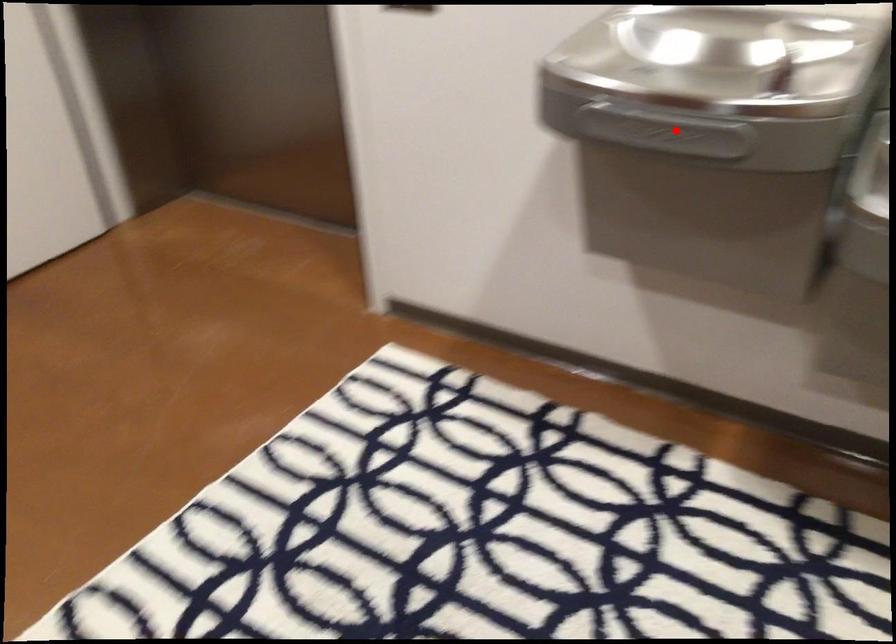
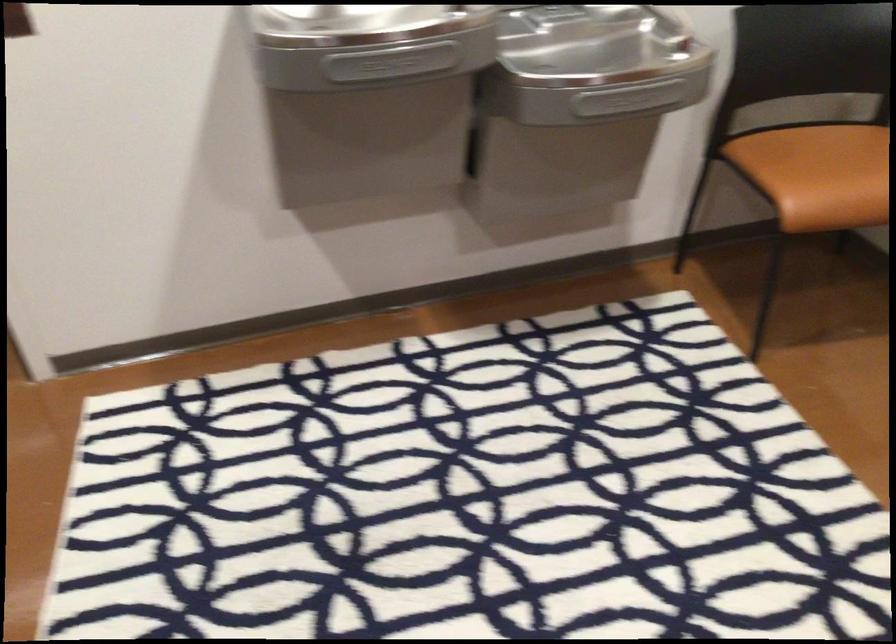
Where in the second image is the point corresponding to the highlighted location from the first image?

(391, 62)